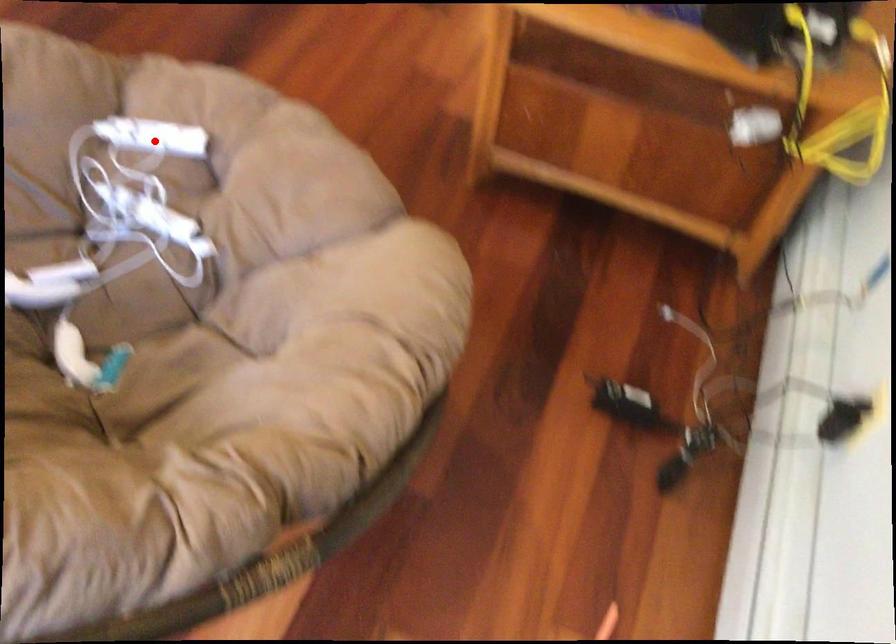
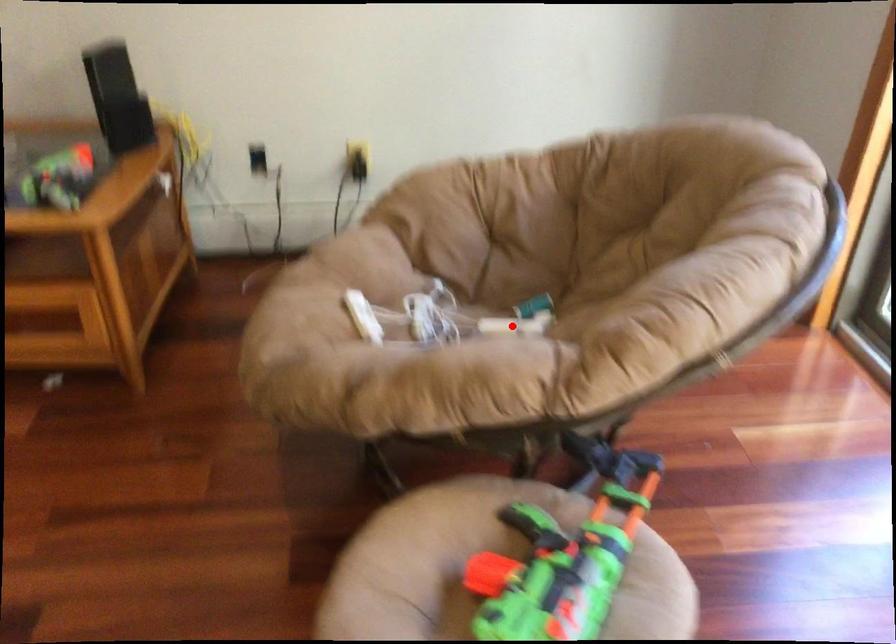
I am providing you with two images of the same scene from different viewpoints. A red point is marked on the first image and another point is marked on the second image. Does the point marked in image1 correspond to the same location as the one in image2?

No